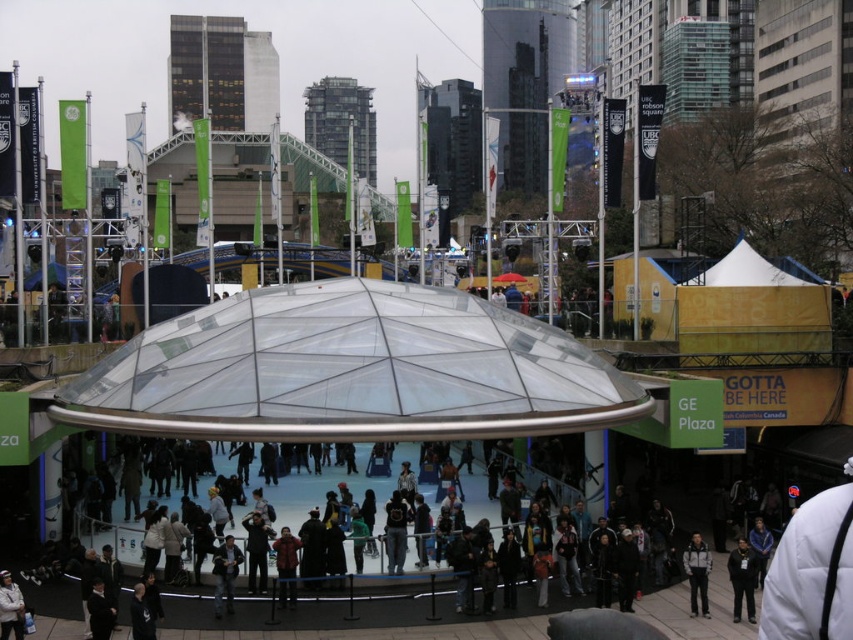
Is the position of transparent glass dome at center less distant than that of white fleece jacket at lower left?

No, it is not.

From the picture: Between transparent glass dome at center and white fleece jacket at lower left, which one has less height?

With less height is white fleece jacket at lower left.

Between point (451, 424) and point (13, 605), which one is positioned in front?

Point (13, 605)

Locate an element on the screen. transparent glass dome at center is located at coordinates (350, 371).

Is white fleece jacket at lower right to the left of dark gray hoodie at center from the viewer's perspective?

No, white fleece jacket at lower right is not to the left of dark gray hoodie at center.

Is point (692, 563) positioned in front of point (393, 518)?

That is True.

Who is more forward, (693, 548) or (396, 570)?

Point (693, 548) is in front.

Identify the location of white fleece jacket at lower right. coord(697,573).

Is transparent glass dome at center in front of white fleece jacket at lower right?

Yes, it is in front of white fleece jacket at lower right.

This screenshot has height=640, width=853. Identify the location of transparent glass dome at center. (350, 371).

Where is `transparent glass dome at center`? transparent glass dome at center is located at coordinates (350, 371).